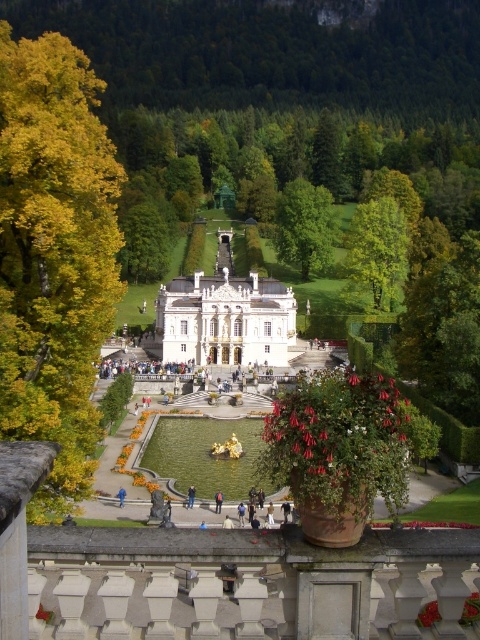
Question: Which point appears closest to the camera in this image?

Choices:
 (A) (330, 253)
 (B) (175, 330)
 (C) (81, 387)
 (D) (188, 488)

Answer: (C)

Question: Which point is farther to the camera?

Choices:
 (A) white marble palace at center
 (B) blue fabric person at center
 (C) blue jeans at lower center
 (D) green leafy tree at center

Answer: (D)

Question: Can you confirm if white marble palace at center is bigger than green leafy tree at upper center?

Choices:
 (A) no
 (B) yes

Answer: (B)

Question: Does blue jeans at lower center have a larger size compared to blue fabric person at center?

Choices:
 (A) yes
 (B) no

Answer: (A)

Question: Which point is closer to the camera?

Choices:
 (A) blue jeans at lower center
 (B) blue fabric person at center
 (C) yellow leafy tree at left
 (D) green leafy tree at center

Answer: (C)

Question: Where is green leafy tree at upper center located in relation to blue jeans at lower center in the image?

Choices:
 (A) right
 (B) left

Answer: (A)